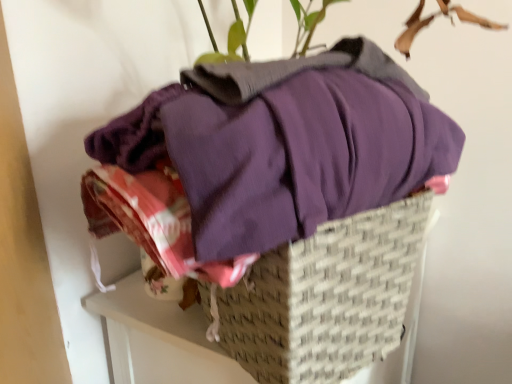
Question: Considering the relative sizes of green leafy plant at upper center and purple cotton shirt at center in the image provided, is green leafy plant at upper center shorter than purple cotton shirt at center?

Choices:
 (A) no
 (B) yes

Answer: (B)

Question: Is green leafy plant at upper center closer to the viewer compared to purple cotton shirt at center?

Choices:
 (A) yes
 (B) no

Answer: (A)

Question: Is green leafy plant at upper center further to the viewer compared to purple cotton shirt at center?

Choices:
 (A) yes
 (B) no

Answer: (B)

Question: Is green leafy plant at upper center looking in the opposite direction of purple cotton shirt at center?

Choices:
 (A) no
 (B) yes

Answer: (A)

Question: Is green leafy plant at upper center bigger than purple cotton shirt at center?

Choices:
 (A) yes
 (B) no

Answer: (A)

Question: From a real-world perspective, is woven beige basket at center positioned above or below green leafy plant at upper center?

Choices:
 (A) above
 (B) below

Answer: (B)

Question: Is woven beige basket at center inside the boundaries of green leafy plant at upper center, or outside?

Choices:
 (A) inside
 (B) outside

Answer: (B)

Question: Is woven beige basket at center taller or shorter than green leafy plant at upper center?

Choices:
 (A) tall
 (B) short

Answer: (A)

Question: Visually, is woven beige basket at center positioned to the left or to the right of green leafy plant at upper center?

Choices:
 (A) right
 (B) left

Answer: (B)

Question: Is point (333, 48) closer or farther from the camera than point (267, 352)?

Choices:
 (A) farther
 (B) closer

Answer: (A)

Question: Is green leafy plant at upper center situated inside woven beige basket at center or outside?

Choices:
 (A) outside
 (B) inside

Answer: (A)

Question: From the image's perspective, is green leafy plant at upper center above or below woven beige basket at center?

Choices:
 (A) below
 (B) above

Answer: (B)

Question: From a real-world perspective, is green leafy plant at upper center positioned above or below woven beige basket at center?

Choices:
 (A) below
 (B) above

Answer: (B)

Question: Would you say purple cotton shirt at center is to the left or to the right of green leafy plant at upper center in the picture?

Choices:
 (A) right
 (B) left

Answer: (B)

Question: From a real-world perspective, is purple cotton shirt at center physically located above or below green leafy plant at upper center?

Choices:
 (A) above
 (B) below

Answer: (B)